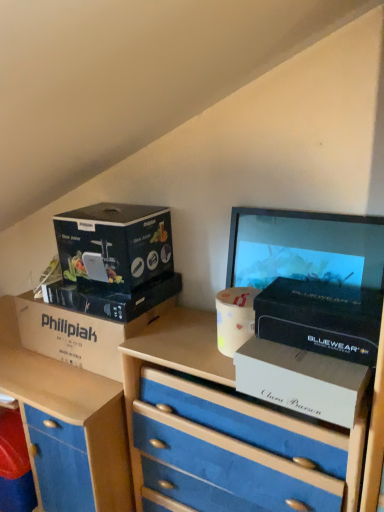
Question: Is matte black box at upper left, positioned as the second box in left-to-right order, touching blue matte drawer at lower left?

Choices:
 (A) no
 (B) yes

Answer: (A)

Question: Is matte black box at upper left, the fourth box positioned from the right, at the right side of blue matte drawer at lower left?

Choices:
 (A) yes
 (B) no

Answer: (A)

Question: Does matte black box at upper left, positioned as the second box in left-to-right order, have a greater height compared to blue matte drawer at lower left?

Choices:
 (A) no
 (B) yes

Answer: (A)

Question: From a real-world perspective, is matte black box at upper left, positioned as the second box in left-to-right order, over blue matte drawer at lower left?

Choices:
 (A) yes
 (B) no

Answer: (A)

Question: Is matte black box at upper left, the fourth box positioned from the right, closer to the viewer compared to blue matte drawer at lower left?

Choices:
 (A) yes
 (B) no

Answer: (A)

Question: Considering the positions of point (296, 403) and point (110, 308), is point (296, 403) closer or farther from the camera than point (110, 308)?

Choices:
 (A) farther
 (B) closer

Answer: (B)

Question: Is white cardboard box at center-right, which is counted as the 4th box, starting from the left, taller or shorter than matte black box at left, which appears as the 3th box when viewed from the right?

Choices:
 (A) short
 (B) tall

Answer: (B)

Question: Is white cardboard box at center-right, which is counted as the 4th box, starting from the left, in front of or behind matte black box at left, which appears as the 3th box when viewed from the right, in the image?

Choices:
 (A) front
 (B) behind

Answer: (A)

Question: Considering the positions of white cardboard box at center-right, the second box viewed from the right, and matte black box at left, marked as the 3th box in a left-to-right arrangement, in the image, is white cardboard box at center-right, the second box viewed from the right, wider or thinner than matte black box at left, marked as the 3th box in a left-to-right arrangement,?

Choices:
 (A) wide
 (B) thin

Answer: (B)

Question: Do you think white cardboard box at center-right, which is counted as the 4th box, starting from the left, is within blue matte drawer at lower left, or outside of it?

Choices:
 (A) inside
 (B) outside

Answer: (B)

Question: From the image's perspective, is white cardboard box at center-right, which is counted as the 4th box, starting from the left, positioned above or below blue matte drawer at lower left?

Choices:
 (A) below
 (B) above

Answer: (B)

Question: Considering the positions of white cardboard box at center-right, the second box viewed from the right, and blue matte drawer at lower left in the image, is white cardboard box at center-right, the second box viewed from the right, wider or thinner than blue matte drawer at lower left?

Choices:
 (A) thin
 (B) wide

Answer: (A)

Question: Considering the relative positions of white cardboard box at center-right, the second box viewed from the right, and blue matte drawer at lower left in the image provided, is white cardboard box at center-right, the second box viewed from the right, to the left or to the right of blue matte drawer at lower left?

Choices:
 (A) right
 (B) left

Answer: (A)

Question: Is matte black box at left, which appears as the 3th box when viewed from the right, inside or outside of matte black computer monitor at upper right?

Choices:
 (A) outside
 (B) inside

Answer: (A)

Question: In terms of height, does matte black box at left, which appears as the 3th box when viewed from the right, look taller or shorter compared to matte black computer monitor at upper right?

Choices:
 (A) short
 (B) tall

Answer: (A)